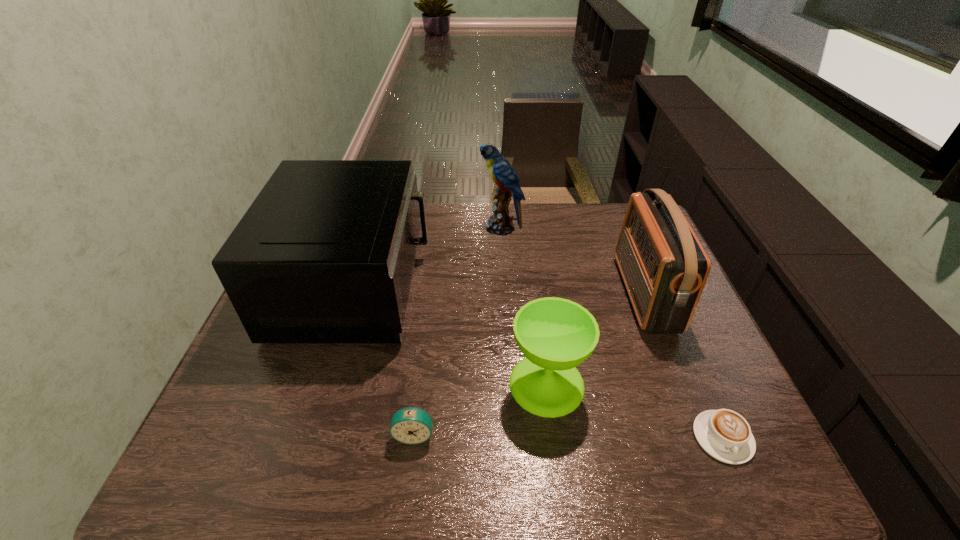
Identify the location of blank area located 0.340m on the front-facing side of the radio receiver. This screenshot has width=960, height=540. (506, 294).

Identify the location of free location located on the front-facing side of the radio receiver. This screenshot has height=540, width=960. (503, 294).

What are the coordinates of `free space located 0.130m on the front-facing side of the microwave_oven` in the screenshot? It's located at (x=470, y=286).

What are the coordinates of `vacant space positioned 0.150m on the front of the wineglass` in the screenshot? It's located at (561, 487).

Find the location of `parrot that is at the far edge`. parrot that is at the far edge is located at coordinates (501, 171).

At what (x,y) coordinates should I click in order to perform the action: click on microwave_oven located at the far edge. Please return your answer as a coordinate pair (x, y). Looking at the image, I should click on pos(325,254).

Find the location of a particular element. The image size is (960, 540). alarm clock located in the near edge section of the desktop is located at coordinates (410, 425).

Image resolution: width=960 pixels, height=540 pixels. I want to click on cappuccino situated at the near edge, so click(x=725, y=435).

In order to click on object at the left edge in this screenshot , I will do `click(325, 254)`.

Locate an element on the screen. radio receiver that is at the right edge is located at coordinates (664, 267).